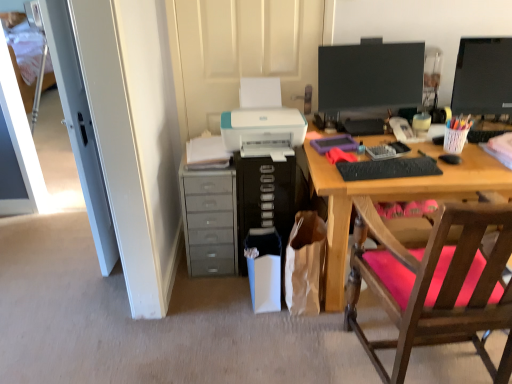
This screenshot has height=384, width=512. Identify the location of vacant area situated below white paper bag at lower center (from a real-world perspective). (301, 322).